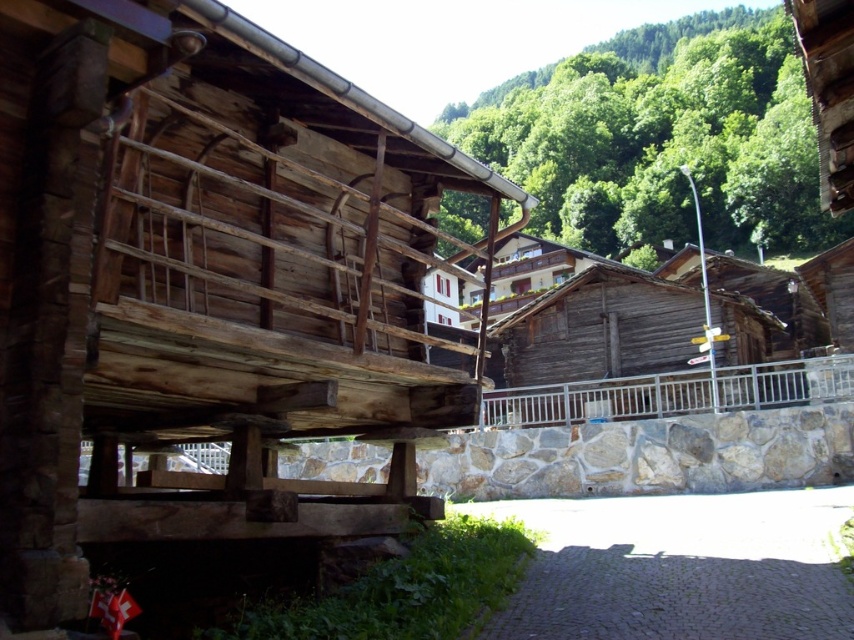
Can you confirm if natural wood hut at center is wider than weathered wood hut at center?

No.

Does natural wood hut at center have a lesser height compared to weathered wood hut at center?

Incorrect, natural wood hut at center's height does not fall short of weathered wood hut at center's.

Measure the distance between point (143,241) and camera.

Point (143,241) and camera are 22.17 feet apart from each other.

This screenshot has width=854, height=640. What are the coordinates of `natural wood hut at center` in the screenshot? It's located at (203, 280).

Is point (314, 200) positioned in front of point (604, 392)?

Yes, it is in front of point (604, 392).

Does natural wood hut at center have a smaller size compared to silver metallic balustrade at center?

Actually, natural wood hut at center might be larger than silver metallic balustrade at center.

Is point (34, 573) farther from camera compared to point (794, 365)?

No.

Identify the location of natural wood hut at center. The height and width of the screenshot is (640, 854). (203, 280).

Does weathered wood hut at center appear on the right side of silver metallic balustrade at center?

Yes, weathered wood hut at center is to the right of silver metallic balustrade at center.

I want to click on weathered wood hut at center, so click(x=594, y=344).

Locate an element on the screen. weathered wood hut at center is located at coordinates (594, 344).

Locate an element on the screen. weathered wood hut at center is located at coordinates (594, 344).